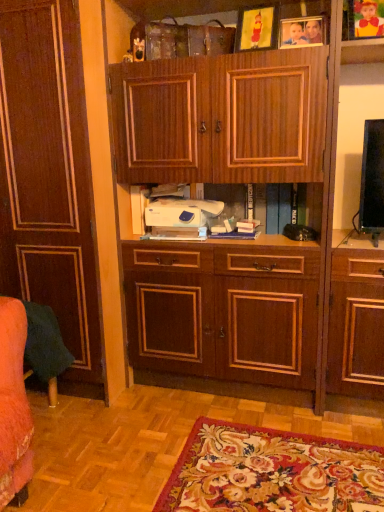
The height and width of the screenshot is (512, 384). Describe the element at coordinates (49, 177) in the screenshot. I see `matte wood cabinet at left` at that location.

Find the location of a particular element. matte wood cabinet at left is located at coordinates (49, 177).

Is matte wood cabinet at left next to wooden picture frame at upper right, which is the first picture frame in right-to-left order, and touching it?

They are not placed beside each other.

What's the angular difference between matte wood cabinet at left and wooden picture frame at upper right, which appears as the 3th picture frame when viewed from the left,'s facing directions?

3.69 degrees.

Is matte wood cabinet at left facing towards wooden picture frame at upper right, which appears as the 3th picture frame when viewed from the left?

No, matte wood cabinet at left is not turned towards wooden picture frame at upper right, which appears as the 3th picture frame when viewed from the left.

From the image's perspective, who appears lower, matte wood cabinet at left or wooden picture frame at upper right, which is the first picture frame in right-to-left order?

From the image's view, matte wood cabinet at left is below.

Is wooden picture frame at upper center, arranged as the second picture frame when viewed from the right, wider or thinner than matte wood cabinet at left?

wooden picture frame at upper center, arranged as the second picture frame when viewed from the right, is thinner than matte wood cabinet at left.

Which is correct: wooden picture frame at upper center, positioned as the second picture frame in left-to-right order, is inside matte wood cabinet at left, or outside of it?

wooden picture frame at upper center, positioned as the second picture frame in left-to-right order, is outside matte wood cabinet at left.

Is wooden picture frame at upper center, arranged as the second picture frame when viewed from the right, facing away from matte wood cabinet at left?

No, wooden picture frame at upper center, arranged as the second picture frame when viewed from the right, is not facing the opposite direction of matte wood cabinet at left.

From the image's perspective, is wooden picture frame at upper center, positioned as the second picture frame in left-to-right order, below matte wood cabinet at left?

No, from the image's perspective, wooden picture frame at upper center, positioned as the second picture frame in left-to-right order, is not beneath matte wood cabinet at left.

Does matte wood cabinet at left contain white plastic printer at center?

No, white plastic printer at center is not inside matte wood cabinet at left.

Based on the photo, who is taller, matte wood cabinet at left or white plastic printer at center?

With more height is matte wood cabinet at left.

From a real-world perspective, is matte wood cabinet at left on top of white plastic printer at center?

Yes, from a real-world perspective, matte wood cabinet at left is on top of white plastic printer at center.

Looking at this image, visually, is matte wood cabinet at left positioned to the left or to the right of white plastic printer at center?

Clearly, matte wood cabinet at left is on the left of white plastic printer at center in the image.

How far apart are white plastic printer at center and wooden picture frame at upper center, positioned as the second picture frame in left-to-right order?

30.62 inches.

From the image's perspective, which object appears higher, white plastic printer at center or wooden picture frame at upper center, positioned as the second picture frame in left-to-right order?

wooden picture frame at upper center, positioned as the second picture frame in left-to-right order.

Is white plastic printer at center located outside wooden picture frame at upper center, positioned as the second picture frame in left-to-right order?

Yes, white plastic printer at center is not within wooden picture frame at upper center, positioned as the second picture frame in left-to-right order.

Which is farther, (182, 216) or (312, 44)?

The point (182, 216) is farther.

Who is more distant, wooden picture frame at upper center, positioned as the second picture frame in left-to-right order, or yellow paper picture frame at upper center, the 3th picture frame when ordered from right to left?

wooden picture frame at upper center, positioned as the second picture frame in left-to-right order, is more distant.

Between wooden picture frame at upper center, arranged as the second picture frame when viewed from the right, and yellow paper picture frame at upper center, which is counted as the first picture frame, starting from the left, which one has larger size?

yellow paper picture frame at upper center, which is counted as the first picture frame, starting from the left, is bigger.

Is wooden picture frame at upper center, positioned as the second picture frame in left-to-right order, looking in the opposite direction of yellow paper picture frame at upper center, which is counted as the first picture frame, starting from the left?

No, wooden picture frame at upper center, positioned as the second picture frame in left-to-right order, is not facing the opposite direction of yellow paper picture frame at upper center, which is counted as the first picture frame, starting from the left.

Do you think wooden picture frame at upper center, positioned as the second picture frame in left-to-right order, is within yellow paper picture frame at upper center, which is counted as the first picture frame, starting from the left, or outside of it?

wooden picture frame at upper center, positioned as the second picture frame in left-to-right order, exists outside the volume of yellow paper picture frame at upper center, which is counted as the first picture frame, starting from the left.

In the image, is yellow paper picture frame at upper center, the 3th picture frame when ordered from right to left, positioned in front of or behind wooden picture frame at upper right, which appears as the 3th picture frame when viewed from the left?

yellow paper picture frame at upper center, the 3th picture frame when ordered from right to left, is positioned farther from the viewer than wooden picture frame at upper right, which appears as the 3th picture frame when viewed from the left.

Is yellow paper picture frame at upper center, which is counted as the first picture frame, starting from the left, touching wooden picture frame at upper right, which appears as the 3th picture frame when viewed from the left?

They are not placed beside each other.

From the picture: Is yellow paper picture frame at upper center, which is counted as the first picture frame, starting from the left, to the left of wooden picture frame at upper right, which is the first picture frame in right-to-left order, from the viewer's perspective?

Yes.

In terms of width, does yellow paper picture frame at upper center, which is counted as the first picture frame, starting from the left, look wider or thinner when compared to wooden picture frame at upper right, which is the first picture frame in right-to-left order?

Clearly, yellow paper picture frame at upper center, which is counted as the first picture frame, starting from the left, has less width compared to wooden picture frame at upper right, which is the first picture frame in right-to-left order.

Are wooden picture frame at upper right, which is the first picture frame in right-to-left order, and yellow paper picture frame at upper center, which is counted as the first picture frame, starting from the left, far apart?

No.

Is point (373, 1) positioned in front of point (269, 9)?

Yes.

Which object is thinner, wooden picture frame at upper right, which appears as the 3th picture frame when viewed from the left, or yellow paper picture frame at upper center, which is counted as the first picture frame, starting from the left?

yellow paper picture frame at upper center, which is counted as the first picture frame, starting from the left, is thinner.

Where is `picture frame that is the 3rd one when counting upward from the matte wood cabinet at left (from the image's perspective)`? This screenshot has height=512, width=384. picture frame that is the 3rd one when counting upward from the matte wood cabinet at left (from the image's perspective) is located at coordinates (363, 19).

What are the coordinates of `picture frame that is the 1st one above the matte wood cabinet at left (from a real-world perspective)` in the screenshot? It's located at (302, 32).

Estimate the real-world distances between objects in this image. Which object is further from wooden picture frame at upper right, which appears as the 3th picture frame when viewed from the left, matte wood cabinet at left or wooden picture frame at upper center, positioned as the second picture frame in left-to-right order?

matte wood cabinet at left is positioned further to the anchor wooden picture frame at upper right, which appears as the 3th picture frame when viewed from the left.

Based on their spatial positions, is wooden picture frame at upper center, arranged as the second picture frame when viewed from the right, or matte wood cabinet at left closer to white plastic printer at center?

matte wood cabinet at left lies closer to white plastic printer at center than the other object.

Considering their positions, is wooden picture frame at upper right, which appears as the 3th picture frame when viewed from the left, positioned further to yellow paper picture frame at upper center, the 3th picture frame when ordered from right to left, than matte wood cabinet at left?

The object further to yellow paper picture frame at upper center, the 3th picture frame when ordered from right to left, is matte wood cabinet at left.

Based on their spatial positions, is matte wood cabinet at left or wooden picture frame at upper right, which is the first picture frame in right-to-left order, closer to wooden picture frame at upper center, positioned as the second picture frame in left-to-right order?

The object closer to wooden picture frame at upper center, positioned as the second picture frame in left-to-right order, is wooden picture frame at upper right, which is the first picture frame in right-to-left order.

Consider the image. From the image, which object appears to be farther from white plastic printer at center, yellow paper picture frame at upper center, the 3th picture frame when ordered from right to left, or wooden picture frame at upper center, positioned as the second picture frame in left-to-right order?

wooden picture frame at upper center, positioned as the second picture frame in left-to-right order, is further to white plastic printer at center.

Estimate the real-world distances between objects in this image. Which object is closer to white plastic printer at center, yellow paper picture frame at upper center, the 3th picture frame when ordered from right to left, or matte wood cabinet at left?

The object closer to white plastic printer at center is matte wood cabinet at left.

Based on their spatial positions, is wooden picture frame at upper right, which appears as the 3th picture frame when viewed from the left, or matte wood cabinet at left further from white plastic printer at center?

wooden picture frame at upper right, which appears as the 3th picture frame when viewed from the left, is further to white plastic printer at center.

When comparing their distances from wooden picture frame at upper center, arranged as the second picture frame when viewed from the right, does yellow paper picture frame at upper center, the 3th picture frame when ordered from right to left, or white plastic printer at center seem closer?

The object closer to wooden picture frame at upper center, arranged as the second picture frame when viewed from the right, is yellow paper picture frame at upper center, the 3th picture frame when ordered from right to left.

Locate an element on the screen. printer between matte wood cabinet at left and yellow paper picture frame at upper center, the 3th picture frame when ordered from right to left, in the horizontal direction is located at coordinates (180, 216).

Locate an element on the screen. printer between matte wood cabinet at left and wooden picture frame at upper right, which is the first picture frame in right-to-left order, from left to right is located at coordinates (180, 216).

This screenshot has width=384, height=512. I want to click on printer located between matte wood cabinet at left and wooden picture frame at upper center, positioned as the second picture frame in left-to-right order, in the left-right direction, so click(x=180, y=216).

Find the location of `picture frame between matte wood cabinet at left and wooden picture frame at upper center, arranged as the second picture frame when viewed from the right`. picture frame between matte wood cabinet at left and wooden picture frame at upper center, arranged as the second picture frame when viewed from the right is located at coordinates (256, 28).